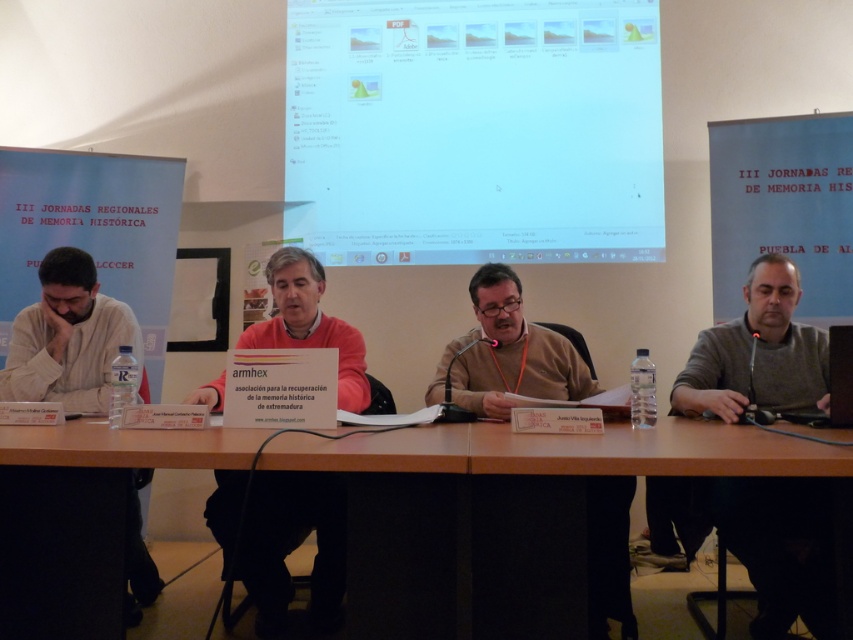
Between point (744, 140) and point (85, 326), which one is positioned behind?

The point (744, 140) is behind.

Who is positioned more to the right, white paper at upper center or matte black sweater at left?

white paper at upper center

At what (x,y) coordinates should I click in order to perform the action: click on white paper at upper center. Please return your answer as a coordinate pair (x, y). Looking at the image, I should click on tap(782, 209).

Does brown wooden table at center have a greater height compared to white paper at upper center?

In fact, brown wooden table at center may be shorter than white paper at upper center.

At what (x,y) coordinates should I click in order to perform the action: click on brown wooden table at center. Please return your answer as a coordinate pair (x, y). Image resolution: width=853 pixels, height=640 pixels. Looking at the image, I should click on (479, 497).

In the scene shown: Who is positioned more to the right, white paper at upper center or brown sweater at center?

From the viewer's perspective, white paper at upper center appears more on the right side.

Does white paper at upper center have a greater height compared to brown sweater at center?

Indeed, white paper at upper center has a greater height compared to brown sweater at center.

The height and width of the screenshot is (640, 853). Find the location of `white paper at upper center`. white paper at upper center is located at coordinates (782, 209).

Image resolution: width=853 pixels, height=640 pixels. I want to click on white paper at upper center, so click(782, 209).